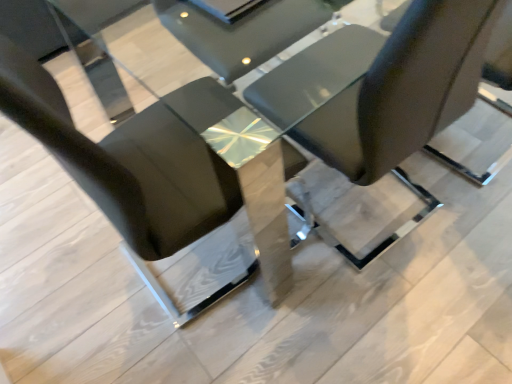
Question: Would you say black leather chair at center, arranged as the 1th chair when viewed from the left, is inside or outside matte black chair at center, the 1th chair in the right-to-left sequence?

Choices:
 (A) inside
 (B) outside

Answer: (B)

Question: Considering their positions, is black leather chair at center, which is the 2th chair from right to left, located in front of or behind matte black chair at center, the 1th chair in the right-to-left sequence?

Choices:
 (A) front
 (B) behind

Answer: (A)

Question: Is point (187, 173) closer or farther from the camera than point (391, 46)?

Choices:
 (A) closer
 (B) farther

Answer: (B)

Question: Is matte black chair at center, the second chair in the left-to-right sequence, situated inside black leather chair at center, which is the 2th chair from right to left, or outside?

Choices:
 (A) outside
 (B) inside

Answer: (A)

Question: From the image's perspective, is matte black chair at center, the 1th chair in the right-to-left sequence, located above or below black leather chair at center, arranged as the 1th chair when viewed from the left?

Choices:
 (A) above
 (B) below

Answer: (A)

Question: Does point (419, 104) appear closer or farther from the camera than point (196, 286)?

Choices:
 (A) closer
 (B) farther

Answer: (A)

Question: In terms of width, does matte black chair at center, the 1th chair in the right-to-left sequence, look wider or thinner when compared to black leather chair at center, which is the 2th chair from right to left?

Choices:
 (A) wide
 (B) thin

Answer: (B)